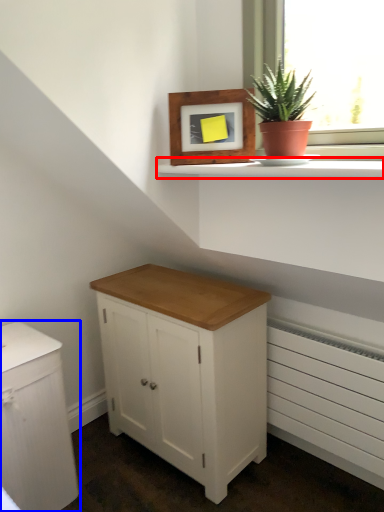
Question: Which object appears closest to the camera in this image, window sill (highlighted by a red box) or chest of drawers (highlighted by a blue box)?

Choices:
 (A) window sill
 (B) chest of drawers

Answer: (A)